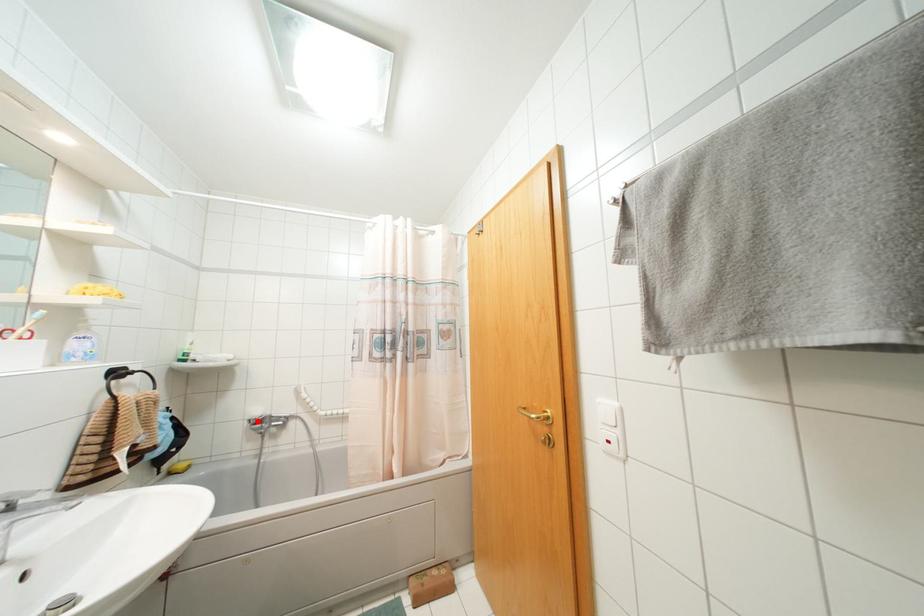
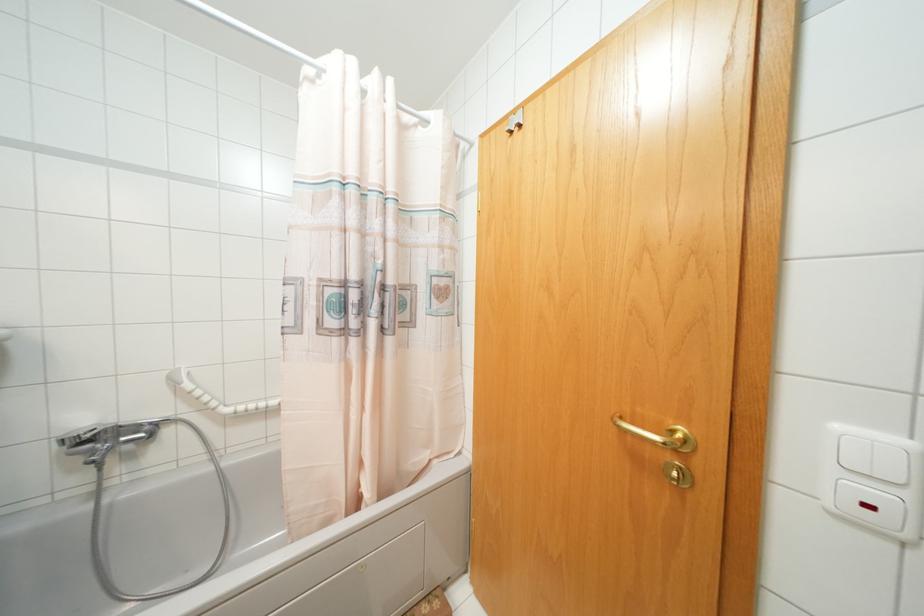
Where in the second image is the point corresponding to the highlighted location from the first image?

(84, 440)